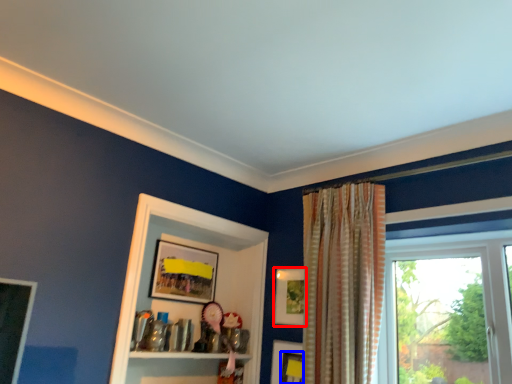
Question: Which of the following is the farthest to the observer, picture frame (highlighted by a red box) or picture frame (highlighted by a blue box)?

Choices:
 (A) picture frame
 (B) picture frame

Answer: (A)